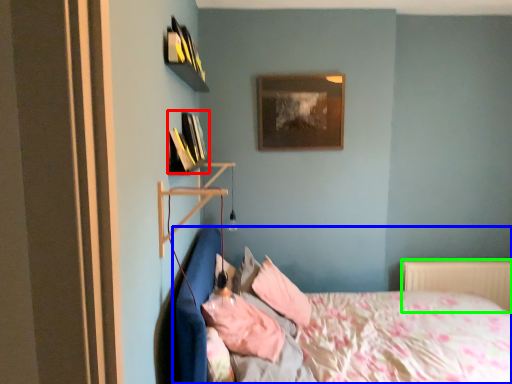
Question: Which object is the farthest from book (highlighted by a red box)? Choose among these: bed (highlighted by a blue box) or radiator (highlighted by a green box).

Choices:
 (A) bed
 (B) radiator

Answer: (B)